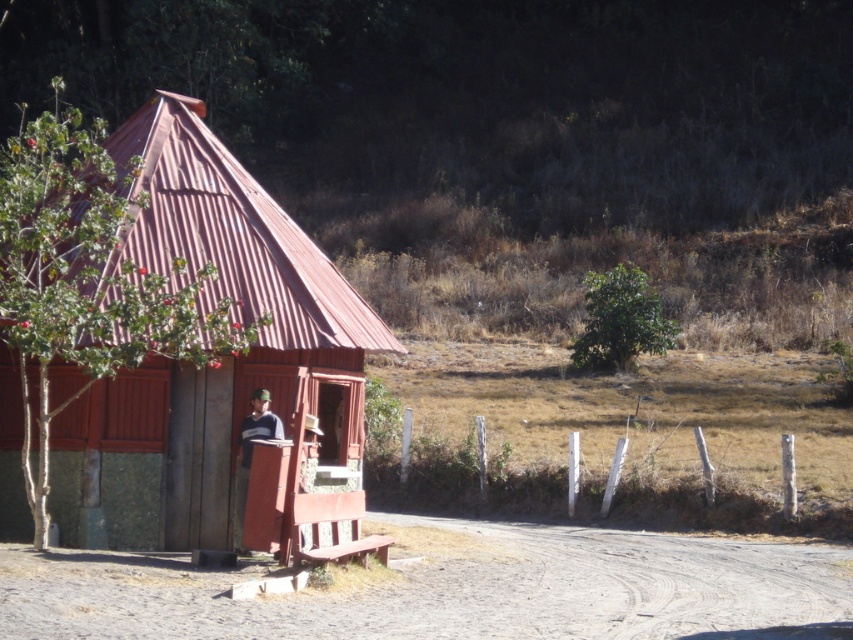
Question: Which object appears closest to the camera in this image?

Choices:
 (A) rustic wood cabin at left
 (B) dirt track at lower center

Answer: (B)

Question: Does rustic wood cabin at left have a smaller size compared to dirt track at lower center?

Choices:
 (A) yes
 (B) no

Answer: (A)

Question: Is rustic wood cabin at left further to the viewer compared to dirt track at lower center?

Choices:
 (A) yes
 (B) no

Answer: (A)

Question: Among these points, which one is nearest to the camera?

Choices:
 (A) (508, 595)
 (B) (204, 452)

Answer: (A)

Question: From the image, what is the correct spatial relationship of rustic wood cabin at left in relation to dirt track at lower center?

Choices:
 (A) above
 (B) below

Answer: (A)